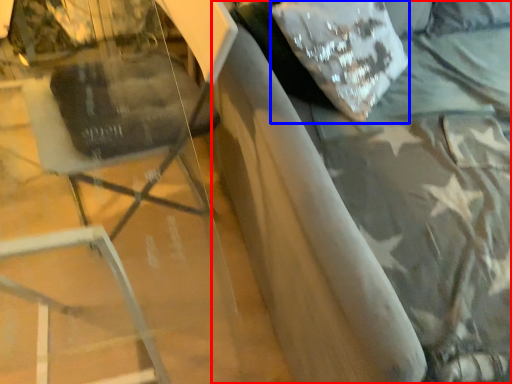
Question: Among these objects, which one is farthest to the camera, bed (highlighted by a red box) or pillow (highlighted by a blue box)?

Choices:
 (A) bed
 (B) pillow

Answer: (B)